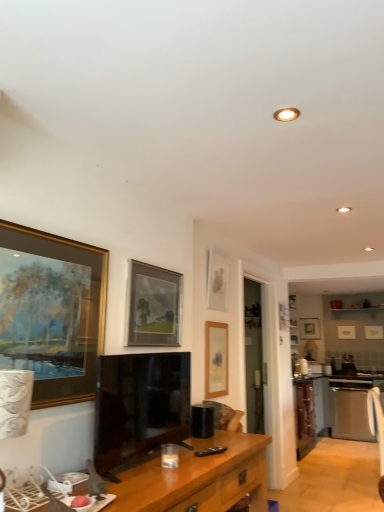
Question: From the image's perspective, is matte gold picture frame at upper right, acting as the second picture frame starting from the right, located beneath stainless steel oven at right?

Choices:
 (A) yes
 (B) no

Answer: (B)

Question: Can you confirm if matte gold picture frame at upper right, acting as the sixth picture frame starting from the front, is positioned to the right of stainless steel oven at right?

Choices:
 (A) no
 (B) yes

Answer: (B)

Question: Is matte gold picture frame at upper right, the 2th picture frame when ordered from back to front, to the left of stainless steel oven at right from the viewer's perspective?

Choices:
 (A) yes
 (B) no

Answer: (B)

Question: From a real-world perspective, is matte gold picture frame at upper right, which appears as the sixth picture frame when viewed from the left, positioned over stainless steel oven at right based on gravity?

Choices:
 (A) yes
 (B) no

Answer: (A)

Question: Is matte gold picture frame at upper right, acting as the sixth picture frame starting from the front, wider than stainless steel oven at right?

Choices:
 (A) yes
 (B) no

Answer: (B)

Question: Is wooden picture frame at center, which ranks as the fifth picture frame in back-to-front order, to the left or to the right of wooden desk at lower center in the image?

Choices:
 (A) right
 (B) left

Answer: (A)

Question: Does point (223, 355) appear closer or farther from the camera than point (190, 505)?

Choices:
 (A) farther
 (B) closer

Answer: (A)

Question: From the image's perspective, relative to wooden desk at lower center, is wooden picture frame at center, which ranks as the fifth picture frame in back-to-front order, above or below?

Choices:
 (A) below
 (B) above

Answer: (B)

Question: From their relative heights in the image, would you say wooden picture frame at center, which ranks as the fifth picture frame in back-to-front order, is taller or shorter than wooden desk at lower center?

Choices:
 (A) short
 (B) tall

Answer: (B)

Question: Is matte wooden picture frame at upper center, which is the 4th picture frame in front-to-back order, to the left or to the right of black matte speaker at center, the 2th appliance positioned from the bottom, in the image?

Choices:
 (A) right
 (B) left

Answer: (A)

Question: Is matte wooden picture frame at upper center, which ranks as the 4th picture frame in right-to-left order, in front of or behind black matte speaker at center, arranged as the 2th appliance when viewed from the back, in the image?

Choices:
 (A) front
 (B) behind

Answer: (B)

Question: From their relative heights in the image, would you say matte wooden picture frame at upper center, which is the 4th picture frame in back-to-front order, is taller or shorter than black matte speaker at center, placed as the first appliance when sorted from top to bottom?

Choices:
 (A) short
 (B) tall

Answer: (B)

Question: Considering the positions of point tap(220, 287) and point tap(190, 408), is point tap(220, 287) closer or farther from the camera than point tap(190, 408)?

Choices:
 (A) farther
 (B) closer

Answer: (A)

Question: Considering the positions of point (357, 385) and point (299, 334), is point (357, 385) closer or farther from the camera than point (299, 334)?

Choices:
 (A) farther
 (B) closer

Answer: (B)

Question: Is stainless steel oven at right in front of or behind matte gold picture frame at center, marked as the 7th picture frame in a front-to-back arrangement, in the image?

Choices:
 (A) behind
 (B) front

Answer: (B)